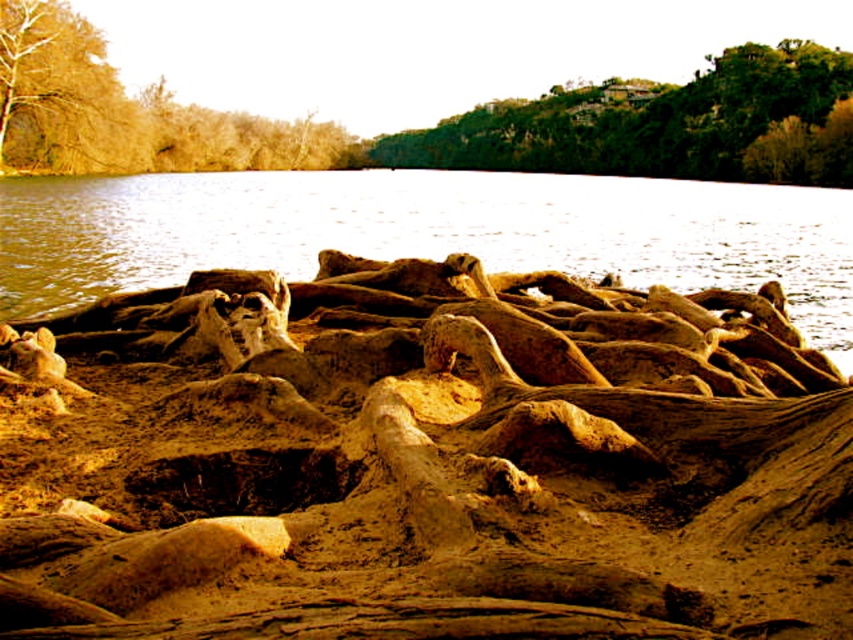
Question: Based on their relative distances, which object is nearer to the brown textured sand at center?

Choices:
 (A) brown textured tree at upper left
 (B) green leafy tree at upper center

Answer: (A)

Question: Which point is farther from the camera taking this photo?

Choices:
 (A) (840, 176)
 (B) (48, 336)
 (C) (22, 77)

Answer: (A)

Question: Which point is farther from the camera taking this photo?

Choices:
 (A) (16, 52)
 (B) (454, 157)
 (C) (412, 412)

Answer: (B)

Question: Can you confirm if green leafy tree at upper center is smaller than brown textured tree at upper left?

Choices:
 (A) no
 (B) yes

Answer: (A)

Question: Can you confirm if brown textured sand at center is wider than green leafy tree at upper center?

Choices:
 (A) no
 (B) yes

Answer: (A)

Question: Does brown textured sand at center appear on the right side of green leafy tree at upper center?

Choices:
 (A) yes
 (B) no

Answer: (B)